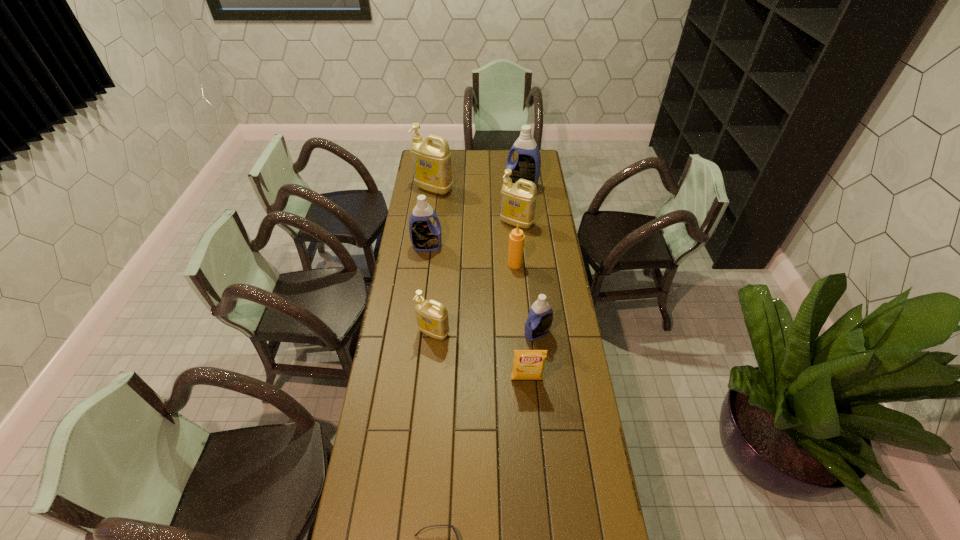
This screenshot has width=960, height=540. Identify the location of the farthest beige detergent. (431, 161).

The width and height of the screenshot is (960, 540). What are the coordinates of `the farthest blue detergent` in the screenshot? It's located at (527, 166).

I want to click on the fourth nearest detergent, so click(518, 201).

Locate an element on the screen. This screenshot has width=960, height=540. the second nearest beige detergent is located at coordinates (518, 201).

At what (x,y) coordinates should I click in order to perform the action: click on the leftmost blue detergent. Please return your answer as a coordinate pair (x, y). Looking at the image, I should click on (425, 236).

Image resolution: width=960 pixels, height=540 pixels. I want to click on the sixth nearest object, so (x=425, y=236).

At what (x,y) coordinates should I click in order to perform the action: click on tan condiment. Please return your answer as a coordinate pair (x, y). Image resolution: width=960 pixels, height=540 pixels. Looking at the image, I should click on (516, 238).

Locate an element on the screen. condiment is located at coordinates (516, 238).

Locate an element on the screen. This screenshot has height=540, width=960. the nearest beige detergent is located at coordinates (432, 317).

The image size is (960, 540). What are the coordinates of `the smallest blue detergent` in the screenshot? It's located at (539, 321).